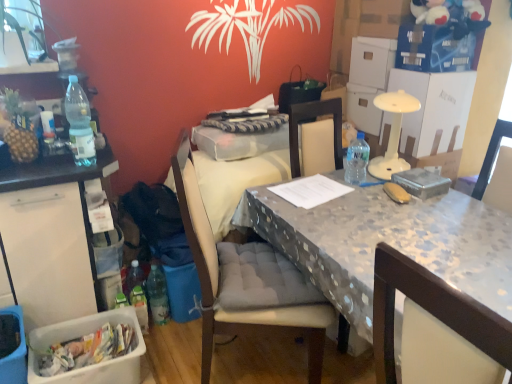
This screenshot has width=512, height=384. In order to click on vacant region to the left of translucent plastic bottle at left, which is counted as the 3th bottle, starting from the bottom in this screenshot , I will do `click(56, 158)`.